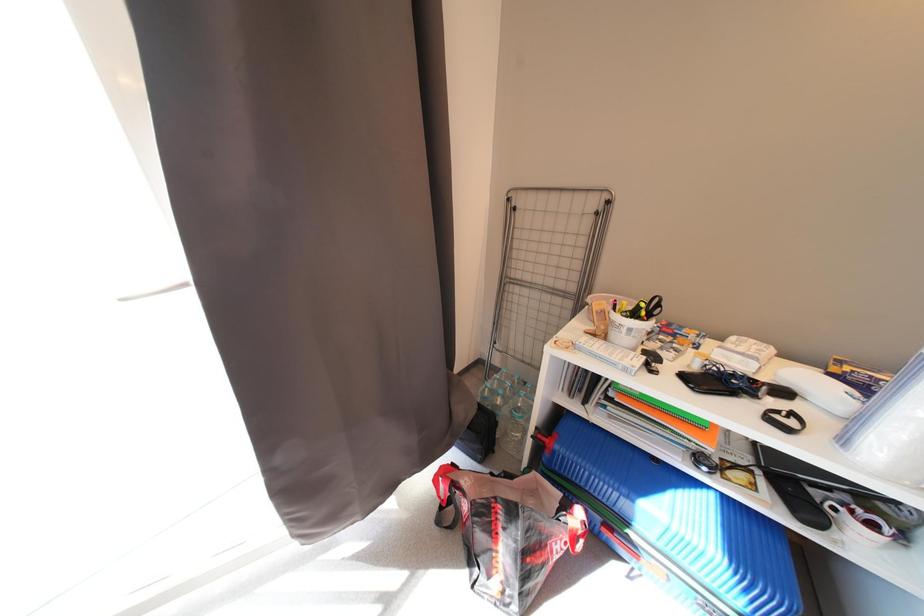
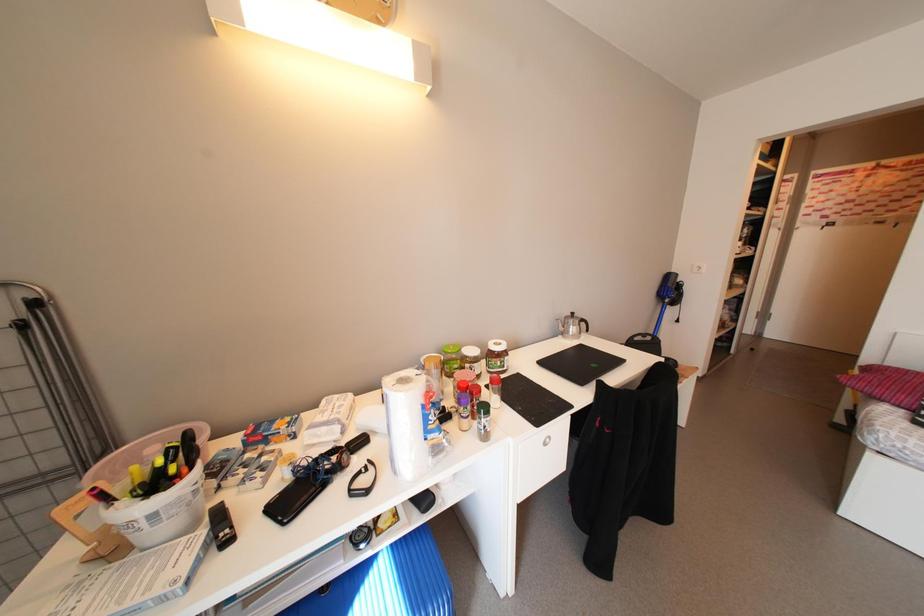
Question: The images are taken continuously from a first-person perspective. In which direction is your viewpoint rotating?

Choices:
 (A) Left
 (B) Right
 (C) Up
 (D) Down

Answer: (B)